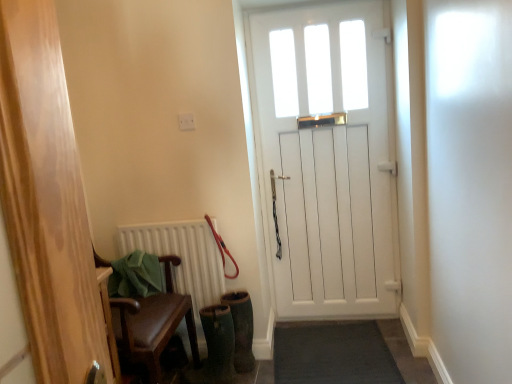
Question: From the image's perspective, is green suede boot at lower center beneath white wooden door at center?

Choices:
 (A) yes
 (B) no

Answer: (A)

Question: Would you say green suede boot at lower center contains white wooden door at center?

Choices:
 (A) no
 (B) yes

Answer: (A)

Question: Can you confirm if green suede boot at lower center is bigger than white wooden door at center?

Choices:
 (A) yes
 (B) no

Answer: (B)

Question: From a real-world perspective, is green suede boot at lower center physically below white wooden door at center?

Choices:
 (A) yes
 (B) no

Answer: (A)

Question: Does green suede boot at lower center have a smaller size compared to white wooden door at center?

Choices:
 (A) no
 (B) yes

Answer: (B)

Question: Is white matte radiator at lower left to the left or to the right of green suede boot at lower center in the image?

Choices:
 (A) right
 (B) left

Answer: (B)

Question: Relative to green suede boot at lower center, is white matte radiator at lower left in front or behind?

Choices:
 (A) behind
 (B) front

Answer: (A)

Question: Is white matte radiator at lower left taller or shorter than green suede boot at lower center?

Choices:
 (A) short
 (B) tall

Answer: (B)

Question: From a real-world perspective, is white matte radiator at lower left positioned above or below green suede boot at lower center?

Choices:
 (A) above
 (B) below

Answer: (A)

Question: From the image's perspective, relative to red rubber leash at center, is white wooden door at center above or below?

Choices:
 (A) below
 (B) above

Answer: (B)

Question: Considering the positions of white wooden door at center and red rubber leash at center in the image, is white wooden door at center bigger or smaller than red rubber leash at center?

Choices:
 (A) small
 (B) big

Answer: (B)

Question: In the image, is white wooden door at center positioned in front of or behind red rubber leash at center?

Choices:
 (A) behind
 (B) front

Answer: (A)

Question: Considering the positions of point (391, 301) and point (223, 256), is point (391, 301) closer or farther from the camera than point (223, 256)?

Choices:
 (A) farther
 (B) closer

Answer: (A)

Question: Is point (238, 271) closer or farther from the camera than point (242, 314)?

Choices:
 (A) farther
 (B) closer

Answer: (A)

Question: Relative to green suede boot at lower center, is red rubber leash at center in front or behind?

Choices:
 (A) front
 (B) behind

Answer: (B)